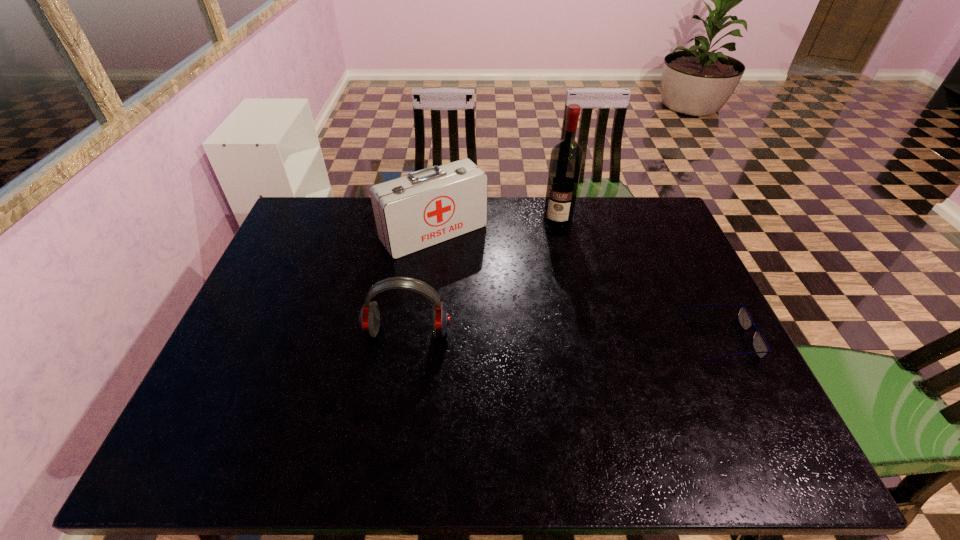
Locate an element on the screen. The height and width of the screenshot is (540, 960). vacant space on the desktop that is between the third tallest object and the rightmost object and is positioned on the front and back of the tallest object is located at coordinates (532, 334).

Identify the location of vacant spot on the desktop that is between the third tallest object and the shortest object and is positioned on the front-facing side of the second tallest object. This screenshot has height=540, width=960. (518, 334).